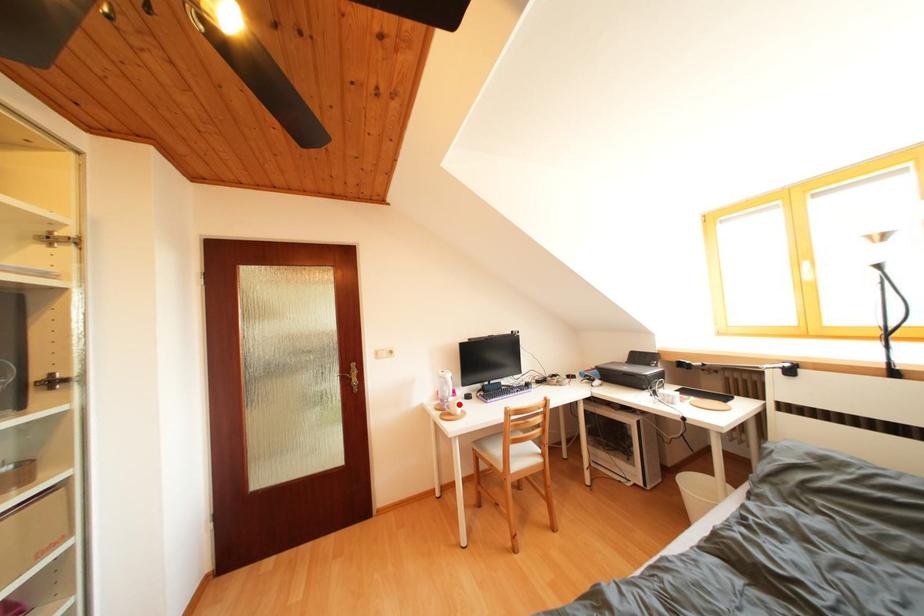
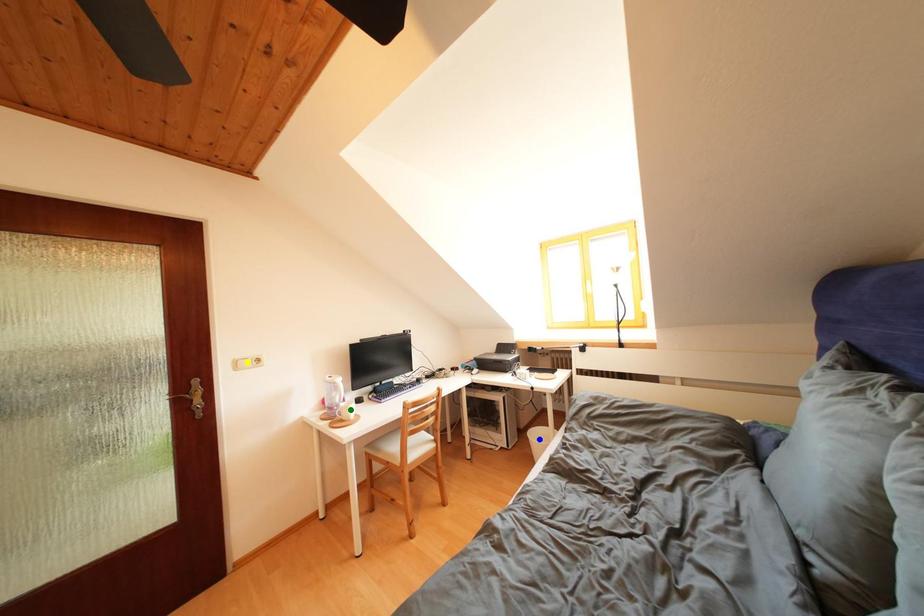
Question: I am providing you with two images of the same scene from different viewpoints. A red point is marked on the first image. You are given multiple points on the second image. Which point in image 2 is actually the same real-world point as the red point in image 1?

Choices:
 (A) green point
 (B) blue point
 (C) yellow point

Answer: (A)